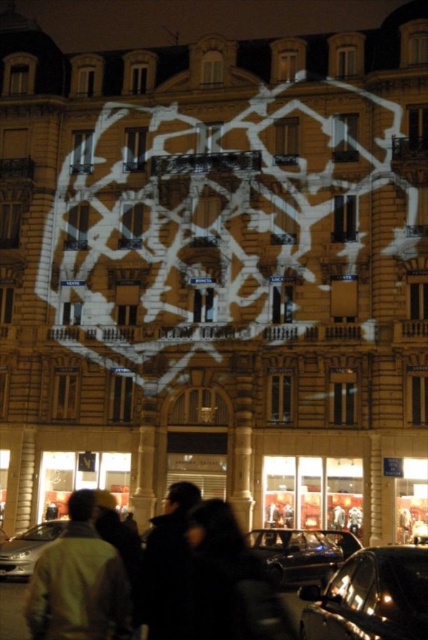
Is shiny black car at lower right behind shiny silver car at lower left?

No, shiny black car at lower right is closer to the viewer.

Who is positioned more to the left, shiny black car at lower right or shiny silver car at lower left?

From the viewer's perspective, shiny silver car at lower left appears more on the left side.

Image resolution: width=428 pixels, height=640 pixels. In order to click on shiny black car at lower right in this screenshot , I will do `click(371, 596)`.

Locate an element on the screen. shiny black car at lower right is located at coordinates (371, 596).

Measure the distance between shiny black car at lower center and shiny silver car at lower left.

They are 12.03 meters apart.

Does point (332, 572) come behind point (24, 573)?

No.

Locate an element on the screen. shiny black car at lower center is located at coordinates (302, 554).

What do you see at coordinates (79, 580) in the screenshot? I see `light brown leather jacket at lower left` at bounding box center [79, 580].

Where is `light brown leather jacket at lower left`? light brown leather jacket at lower left is located at coordinates (79, 580).

Find the location of a particular element. This screenshot has height=640, width=428. light brown leather jacket at lower left is located at coordinates (79, 580).